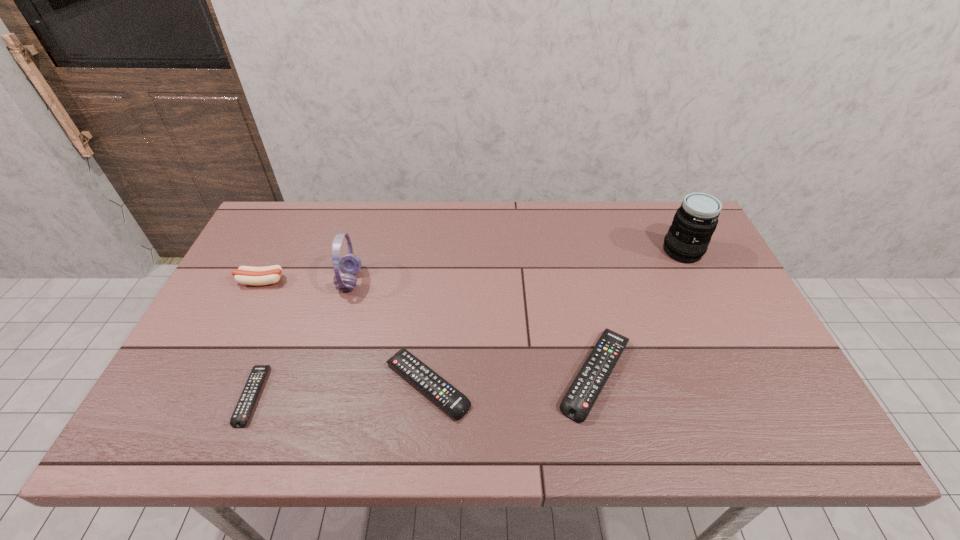
Observe the arrangement of all remote controls in the image. To keep them evenly spaced, where would you place another remote control on the right? Please locate a free space. Please provide its 2D coordinates. Your answer should be formatted as a tuple, i.e. [(x, y)], where the tuple contains the x and y coordinates of a point satisfying the conditions above.

[(757, 364)]